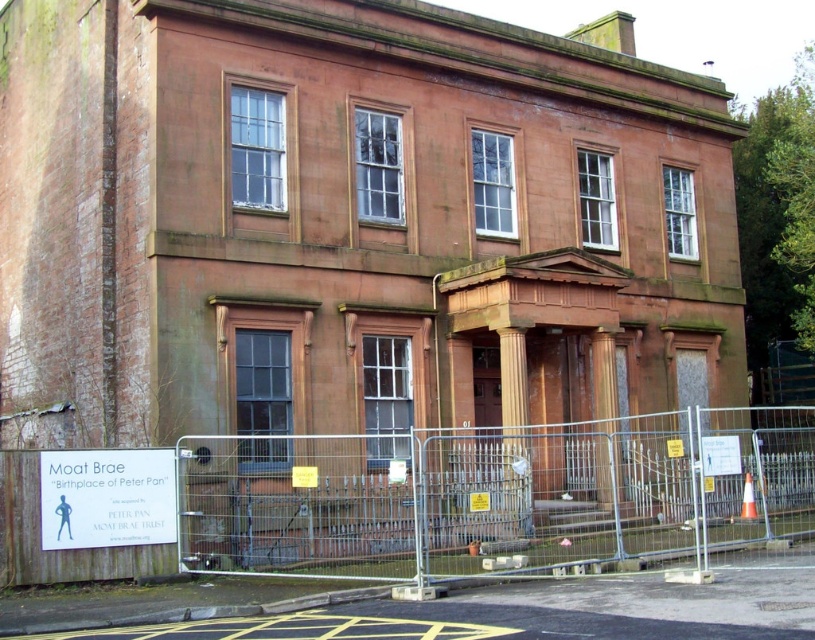
Is silver metallic fence at center above white paper sign at lower left?

No, silver metallic fence at center is not above white paper sign at lower left.

What do you see at coordinates (496, 496) in the screenshot?
I see `silver metallic fence at center` at bounding box center [496, 496].

Where is `silver metallic fence at center`? This screenshot has height=640, width=815. silver metallic fence at center is located at coordinates (496, 496).